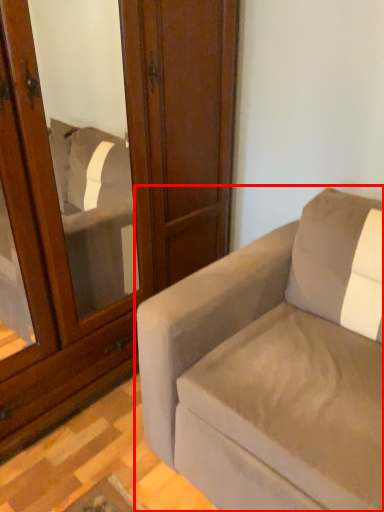
Question: Where is studio couch (annotated by the red box) located in relation to screen door in the image?

Choices:
 (A) right
 (B) left

Answer: (A)